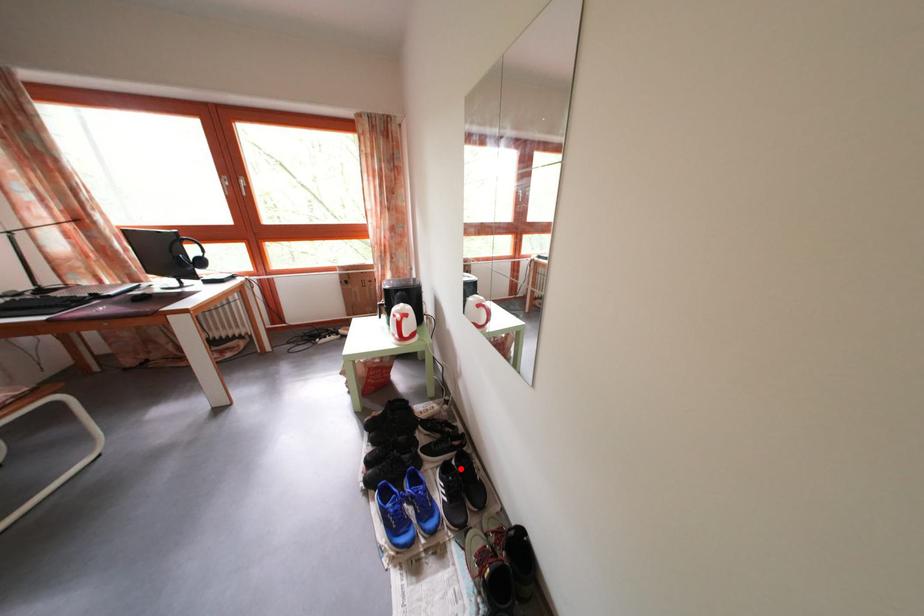
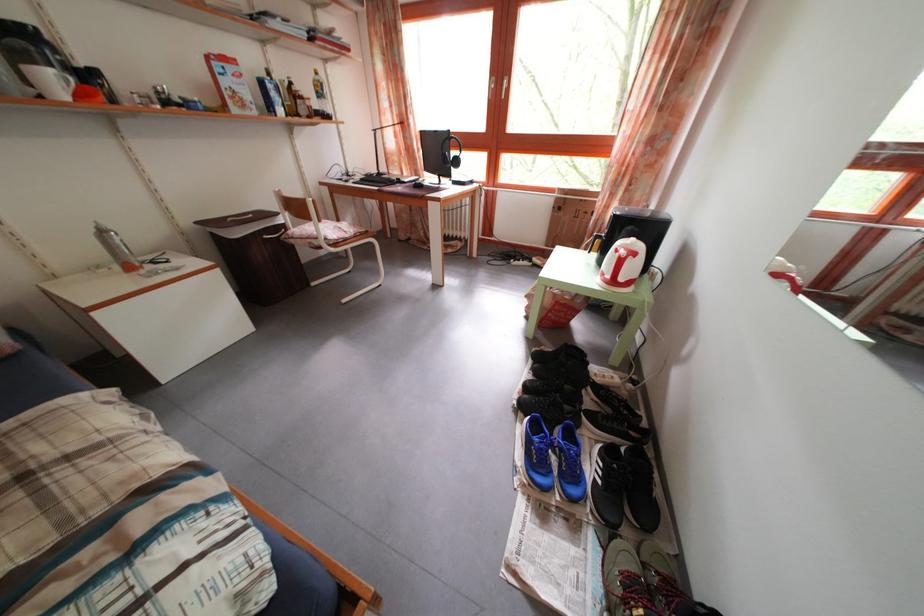
Question: I am providing you with two images of the same scene from different viewpoints. A red point is shown in image1. For the corresponding object point in image2, is it positioned nearer or farther from the camera?

Choices:
 (A) Nearer
 (B) Farther

Answer: (A)